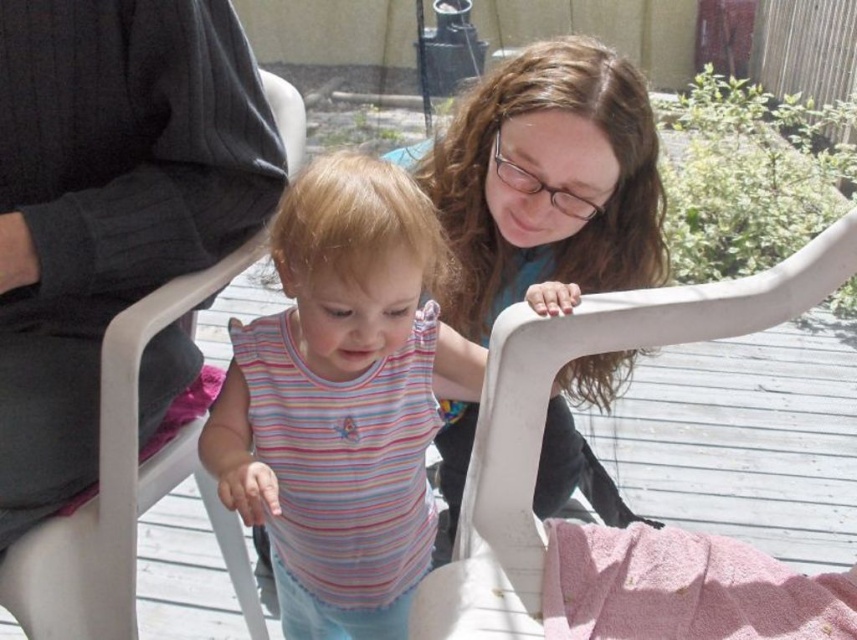
Can you confirm if striped fabric at center is bigger than white plastic chair at left?

Actually, striped fabric at center might be smaller than white plastic chair at left.

Is striped fabric at center smaller than white plastic chair at left?

Yes.

Which is behind, point (405, 216) or point (43, 584)?

Positioned behind is point (43, 584).

Image resolution: width=857 pixels, height=640 pixels. What are the coordinates of `striped fabric at center` in the screenshot? It's located at coord(340,401).

Does matte black shirt at upper center have a smaller size compared to white plastic folding chair at upper center?

No, matte black shirt at upper center is not smaller than white plastic folding chair at upper center.

Between point (480, 108) and point (525, 474), which one is positioned behind?

The point (480, 108) is behind.

The height and width of the screenshot is (640, 857). Find the location of `matte black shirt at upper center`. matte black shirt at upper center is located at coordinates (548, 180).

Can you confirm if striped fabric at center is positioned to the left of white plastic folding chair at upper center?

Indeed, striped fabric at center is positioned on the left side of white plastic folding chair at upper center.

This screenshot has width=857, height=640. Describe the element at coordinates (340, 401) in the screenshot. I see `striped fabric at center` at that location.

Identify the location of striped fabric at center. (340, 401).